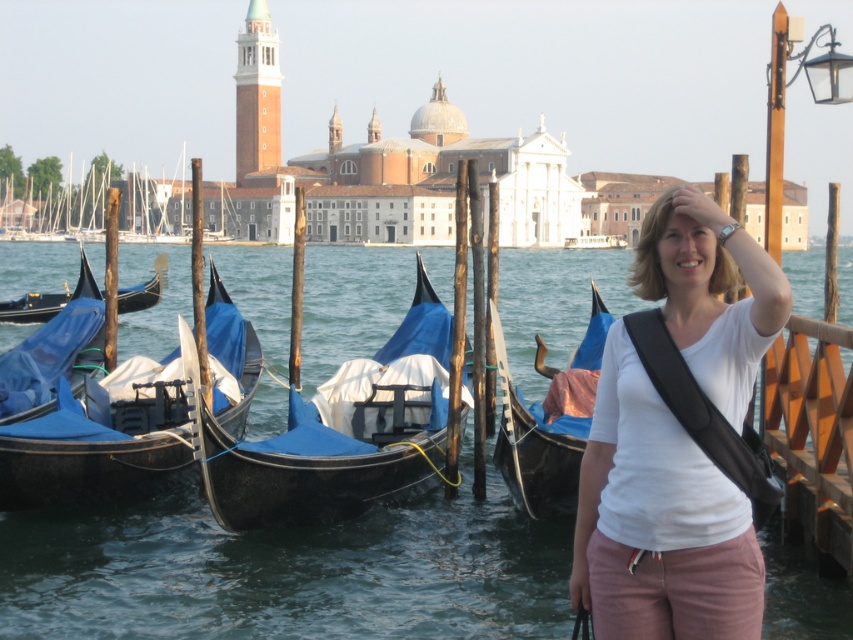
Based on the photo, you are standing on the dock and see a point marked at coordinates (x=537, y=449). What object is located at that point?

The point at (x=537, y=449) indicates the blue fabric boat at right.

You are a tourist standing on the dock in Venice. You see two points marked in the scene. The first point is at coordinates point [798,593] and the second point is at point [440,406]. Which point is closer to you as you face the dock?

Point [798,593] is in front of point [440,406], so the first point is closer to you.

You are standing on the dock and want to walk to the transparent water at center represented by point (288, 572). Are there any gondolas blocking your path?

The transparent water at center is represented by point (288, 572), so there are no gondolas blocking your path because the point indicates the location of the water itself.